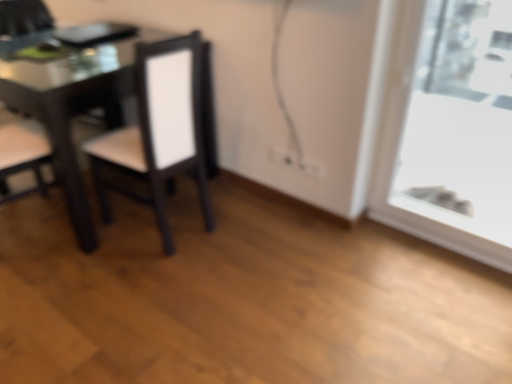
The height and width of the screenshot is (384, 512). In order to click on vacant space underneath matte black chair at center, the first chair from the right (from a real-world perspective) in this screenshot , I will do `click(172, 224)`.